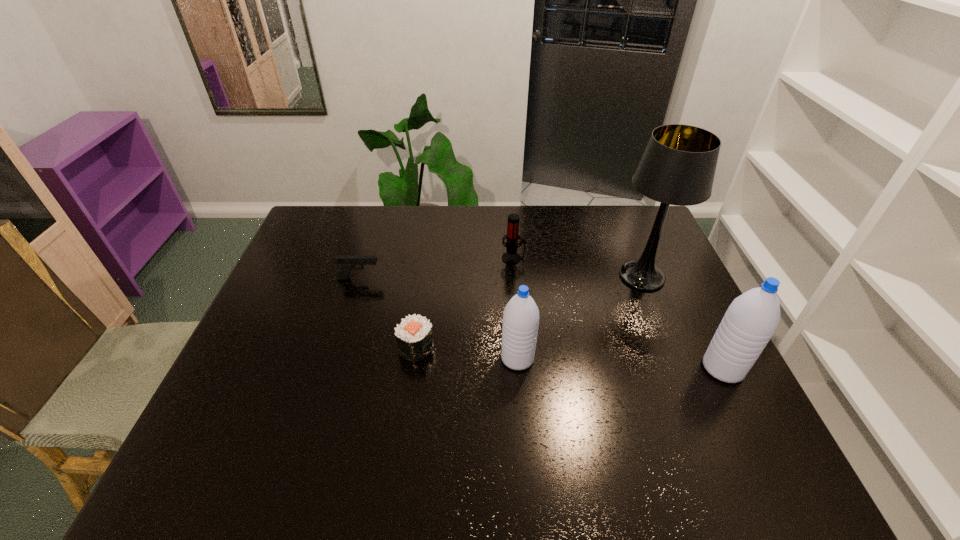
Where is `vacant space in between the fifth object from right to left and the third tallest object`? The width and height of the screenshot is (960, 540). vacant space in between the fifth object from right to left and the third tallest object is located at coordinates (467, 353).

This screenshot has width=960, height=540. What are the coordinates of `free spot between the sushi and the shorter water bottle` in the screenshot? It's located at (467, 353).

Locate an element on the screen. Image resolution: width=960 pixels, height=540 pixels. object identified as the closest to the fourth tallest object is located at coordinates (678, 166).

You are a GUI agent. You are given a task and a screenshot of the screen. Output one action in this format:
    pyautogui.click(x=<x>, y=<y>)
    Task: Click on the object that stands as the closest to the sushi
    This screenshot has height=540, width=960.
    Given the screenshot: What is the action you would take?
    pyautogui.click(x=520, y=325)

Image resolution: width=960 pixels, height=540 pixels. In order to click on vacant area in the image that satisfies the following two spatial constraints: 1. on the front-facing side of the second object from left to right; 2. on the left side of the leftmost object in this screenshot , I will do `click(338, 348)`.

This screenshot has height=540, width=960. In order to click on free space in the image that satisfies the following two spatial constraints: 1. on the front-facing side of the leftmost object; 2. on the right side of the left water bottle in this screenshot , I will do `click(335, 359)`.

Find the location of a particular element. The width and height of the screenshot is (960, 540). vacant space that satisfies the following two spatial constraints: 1. on the front side of the left water bottle; 2. on the left side of the second object from left to right is located at coordinates (415, 359).

This screenshot has width=960, height=540. I want to click on free point that satisfies the following two spatial constraints: 1. on the back side of the fourth shortest object; 2. on the right side of the microphone, so click(x=510, y=258).

Find the location of a particular element. Image resolution: width=960 pixels, height=540 pixels. vacant region that satisfies the following two spatial constraints: 1. on the back side of the second tallest object; 2. on the front-facing side of the leftmost object is located at coordinates (678, 278).

Identify the location of blank space that satisfies the following two spatial constraints: 1. on the front-facing side of the leftmost object; 2. on the right side of the right water bottle. Image resolution: width=960 pixels, height=540 pixels. (332, 368).